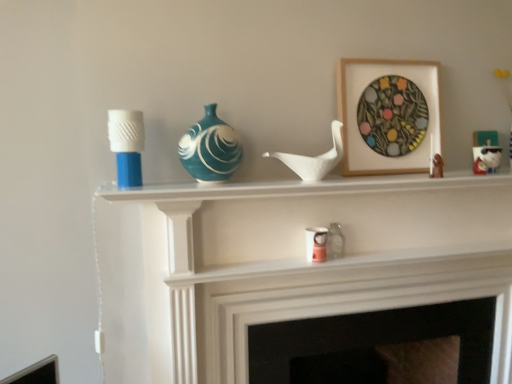
Question: Is pink paper cup at center, which is counted as the second candle holder, starting from the left, surrounded by teal glossy vase at center?

Choices:
 (A) no
 (B) yes

Answer: (A)

Question: From the image's perspective, is teal glossy vase at center beneath pink paper cup at center, arranged as the 1th candle holder when ordered from the bottom?

Choices:
 (A) no
 (B) yes

Answer: (A)

Question: From a real-world perspective, is teal glossy vase at center physically below pink paper cup at center, placed as the 2th candle holder when sorted from front to back?

Choices:
 (A) yes
 (B) no

Answer: (B)

Question: Is teal glossy vase at center completely or partially outside of pink paper cup at center, placed as the 2th candle holder when sorted from front to back?

Choices:
 (A) yes
 (B) no

Answer: (A)

Question: Considering the relative sizes of teal glossy vase at center and pink paper cup at center, which is counted as the second candle holder, starting from the left, in the image provided, is teal glossy vase at center wider than pink paper cup at center, which is counted as the second candle holder, starting from the left,?

Choices:
 (A) no
 (B) yes

Answer: (B)

Question: Is matte brown figurine at upper right, placed as the second toy when sorted from right to left, wider or thinner than pink paper cup at center, placed as the 2th candle holder when sorted from top to bottom?

Choices:
 (A) wide
 (B) thin

Answer: (B)

Question: From the image's perspective, is matte brown figurine at upper right, arranged as the second toy when viewed from the front, positioned above or below pink paper cup at center, arranged as the 1th candle holder when ordered from the bottom?

Choices:
 (A) below
 (B) above

Answer: (B)

Question: Is matte brown figurine at upper right, acting as the second toy starting from the back, bigger or smaller than pink paper cup at center, placed as the 2th candle holder when sorted from top to bottom?

Choices:
 (A) big
 (B) small

Answer: (B)

Question: Does point (434, 160) appear closer or farther from the camera than point (307, 241)?

Choices:
 (A) farther
 (B) closer

Answer: (B)

Question: From the image's perspective, is pink paper cup at center, the 1th candle holder in the right-to-left sequence, positioned above or below wooden picture frame at upper center?

Choices:
 (A) above
 (B) below

Answer: (B)

Question: Based on their sizes in the image, would you say pink paper cup at center, placed as the 2th candle holder when sorted from top to bottom, is bigger or smaller than wooden picture frame at upper center?

Choices:
 (A) small
 (B) big

Answer: (A)

Question: In the image, is pink paper cup at center, which is counted as the second candle holder, starting from the left, on the left side or the right side of wooden picture frame at upper center?

Choices:
 (A) right
 (B) left

Answer: (B)

Question: Considering their positions, is pink paper cup at center, the 1th candle holder in the right-to-left sequence, located in front of or behind wooden picture frame at upper center?

Choices:
 (A) front
 (B) behind

Answer: (A)

Question: Is point (216, 104) closer or farther from the camera than point (441, 168)?

Choices:
 (A) farther
 (B) closer

Answer: (B)

Question: Is teal glossy vase at center spatially inside matte brown figurine at upper right, placed as the second toy when sorted from right to left, or outside of it?

Choices:
 (A) inside
 (B) outside

Answer: (B)